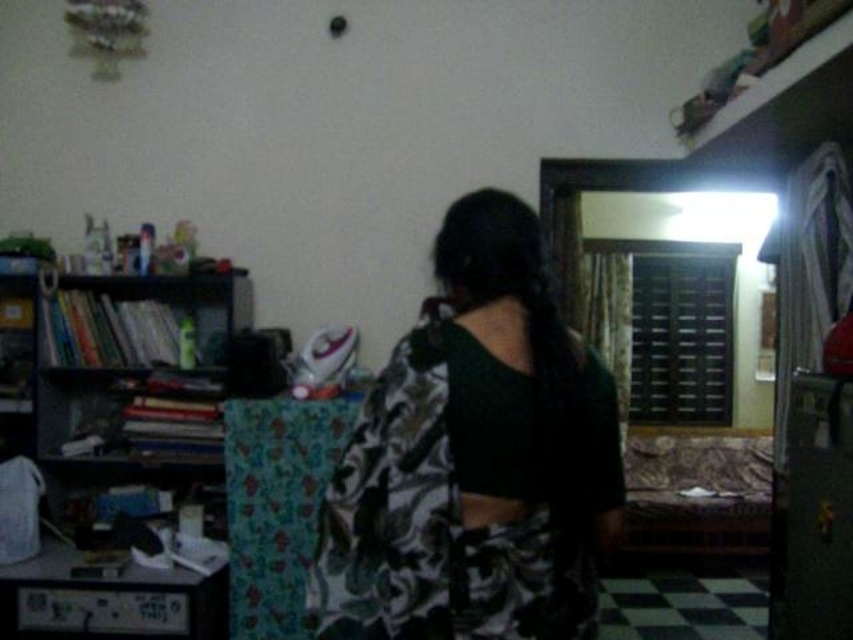
Is printed fabric dress at center above black matte bookshelf at left?

No, printed fabric dress at center is not above black matte bookshelf at left.

Can you confirm if printed fabric dress at center is positioned to the right of black matte bookshelf at left?

Correct, you'll find printed fabric dress at center to the right of black matte bookshelf at left.

Locate an element on the screen. The width and height of the screenshot is (853, 640). printed fabric dress at center is located at coordinates (474, 460).

Identify the location of printed fabric dress at center. point(474,460).